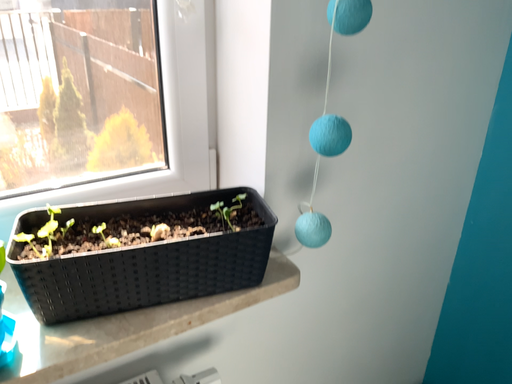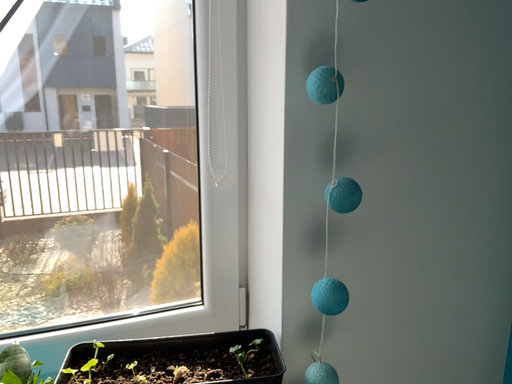
Question: How did the camera likely rotate when shooting the video?

Choices:
 (A) rotated right
 (B) rotated left

Answer: (B)